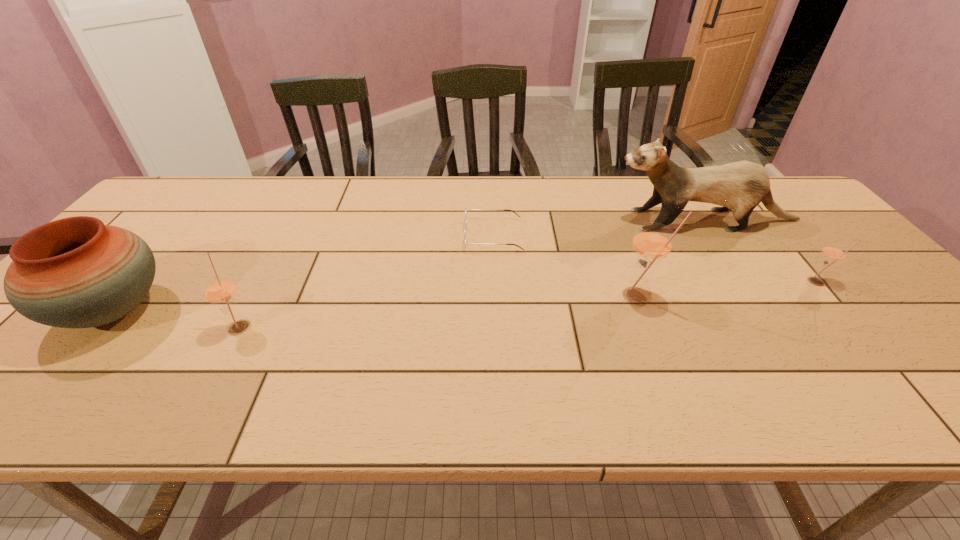
This screenshot has width=960, height=540. What are the coordinates of `unoccupied area between the ferret and the second straw from right to left` in the screenshot? It's located at (671, 258).

Locate an element on the screen. This screenshot has width=960, height=540. vacant space that's between the second straw from left to right and the leftmost object is located at coordinates [x=375, y=303].

Find the location of `blank region between the nearest straw and the spectacles`. blank region between the nearest straw and the spectacles is located at coordinates (367, 281).

Find the location of a particular element. free space between the second object from left to right and the ferret is located at coordinates (472, 273).

The width and height of the screenshot is (960, 540). In order to click on blank region between the spectacles and the leftmost object in this screenshot , I will do `click(303, 273)`.

Identify the location of free space between the second straw from right to left and the shortest object. (565, 266).

Locate an element on the screen. free area in between the pottery and the rightmost straw is located at coordinates (465, 296).

You are a GUI agent. You are given a task and a screenshot of the screen. Output one action in this format:
    pyautogui.click(x=<x>, y=<y>)
    Task: Click on the free space between the ferret and the rightmost straw
    The height and width of the screenshot is (540, 960).
    Given the screenshot: What is the action you would take?
    pyautogui.click(x=760, y=251)

Find the location of a particular element. vacant region between the second straw from right to left and the ferret is located at coordinates (671, 258).

Identify the location of vacant space that's between the tallest straw and the second object from left to right. (439, 310).